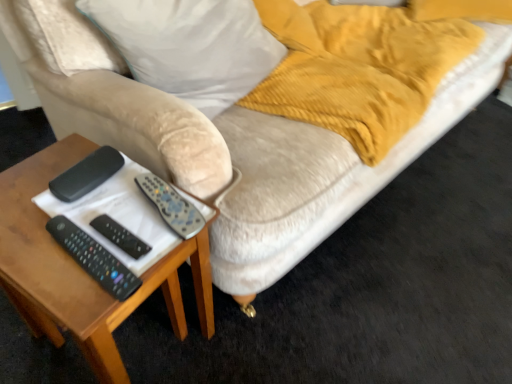
Question: Is white fabric pillow at upper left wider or thinner than wooden table at lower left?

Choices:
 (A) thin
 (B) wide

Answer: (A)

Question: In terms of height, does white fabric pillow at upper left look taller or shorter compared to wooden table at lower left?

Choices:
 (A) tall
 (B) short

Answer: (B)

Question: Which is nearer to the wooden table at lower left?

Choices:
 (A) white fabric pillow at upper left
 (B) black plastic remote control at left
 (C) black plastic remote at lower left, which appears as the third remote when viewed from the top
 (D) black plastic remote at center, arranged as the 2th remote when ordered from the bottom
 (E) silver metallic remote at center, the first remote when ordered from top to bottom

Answer: (C)

Question: Estimate the real-world distances between objects in this image. Which object is closer to the silver metallic remote at center, the first remote when ordered from top to bottom?

Choices:
 (A) black plastic remote at lower left, the first remote from the bottom
 (B) black plastic remote at center, positioned as the second remote in top-to-bottom order
 (C) white fabric pillow at upper left
 (D) wooden table at lower left
 (E) black plastic remote control at left

Answer: (B)